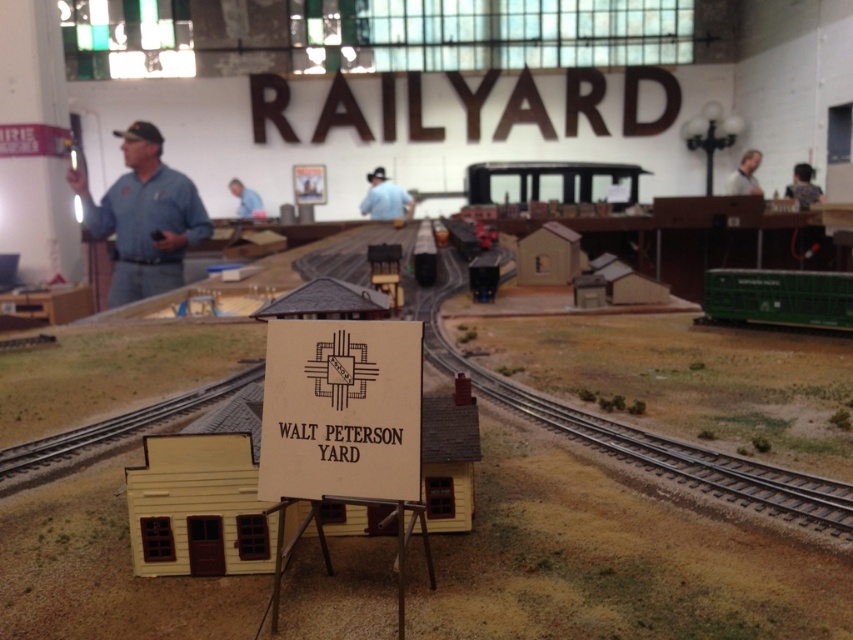
You are a visitor at the model train exhibit and notice two shirts displayed in the scene. Which shirt is positioned more to the left between the blue denim shirt at left and the light blue shirt at upper right?

The blue denim shirt at left is positioned more to the left than the light blue shirt at upper right.

In the scene shown: You are a visitor at the model train exhibit and notice two shirts displayed in the scene. The blue denim shirt at left and the light blue shirt at upper right. Which shirt is taller?

The blue denim shirt at left is much taller than the light blue shirt at upper right.

You are a visitor at the model train exhibit and notice two blue items in the scene. The first is a blue uniform at center and the second is a blue shirt at upper center. Which one is located to the right of the other?

The blue uniform at center is positioned on the right side of blue shirt at upper center.